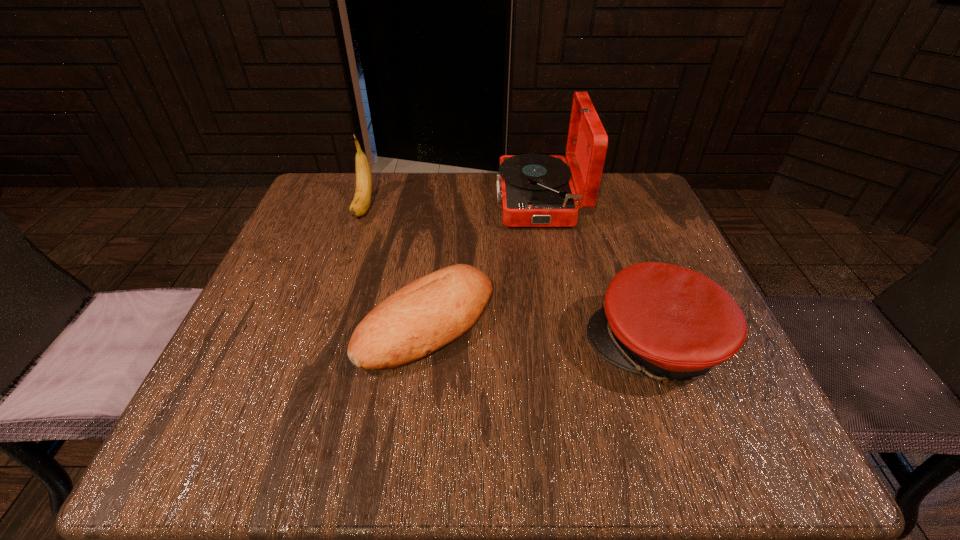
Find the location of a particular element. The width and height of the screenshot is (960, 540). free location at the left edge of the desktop is located at coordinates (334, 246).

Image resolution: width=960 pixels, height=540 pixels. I want to click on free location at the right edge, so click(696, 402).

You are a GUI agent. You are given a task and a screenshot of the screen. Output one action in this format:
    pyautogui.click(x=<x>, y=<y>)
    Task: Click on the free location at the near left corner of the desktop
    The height and width of the screenshot is (540, 960).
    Given the screenshot: What is the action you would take?
    pyautogui.click(x=255, y=409)

Locate an element on the screen. vacant space at the far right corner of the desktop is located at coordinates (635, 195).

Where is `vacant space in between the cap and the third object from right to left`? This screenshot has height=540, width=960. vacant space in between the cap and the third object from right to left is located at coordinates (541, 334).

Where is `vacant space that's between the cap and the third shortest object`? The image size is (960, 540). vacant space that's between the cap and the third shortest object is located at coordinates (510, 276).

Identify the location of vacant area that lies between the third tallest object and the phonograph_record. This screenshot has width=960, height=540. (597, 273).

What are the coordinates of `vacant area between the cap and the second object from left to right` in the screenshot? It's located at (541, 334).

The height and width of the screenshot is (540, 960). In order to click on vacant space in between the third tallest object and the third object from right to left in this screenshot , I will do tap(541, 334).

Image resolution: width=960 pixels, height=540 pixels. Identify the location of vacant space that is in between the bread and the banana. 396,265.